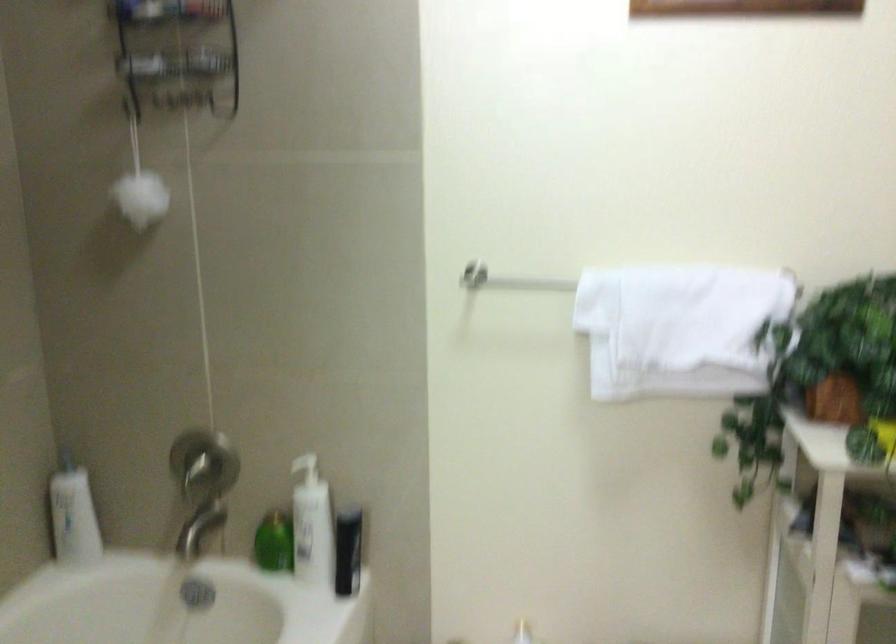
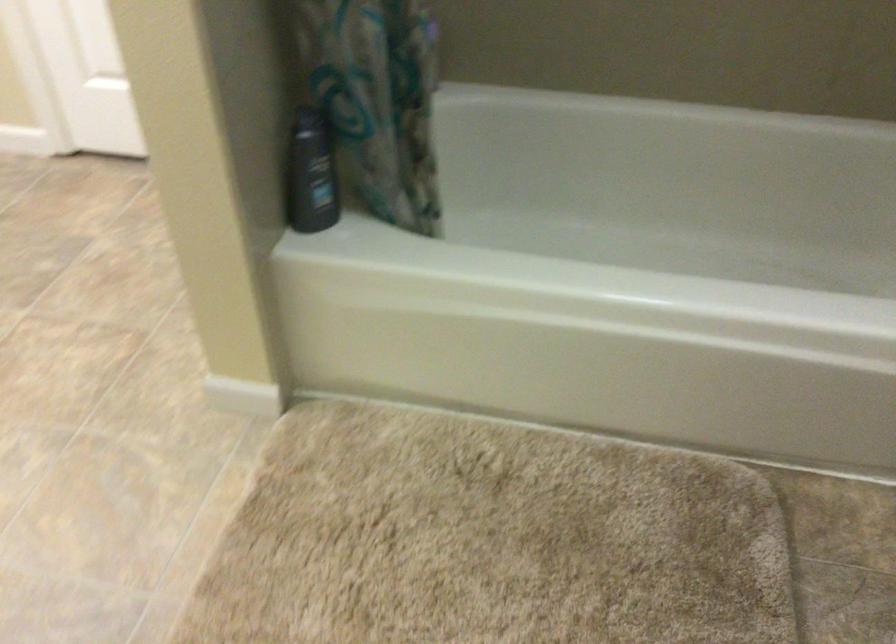
The images are taken continuously from a first-person perspective. In which direction is your viewpoint rotating?

The camera rotated toward left-down.